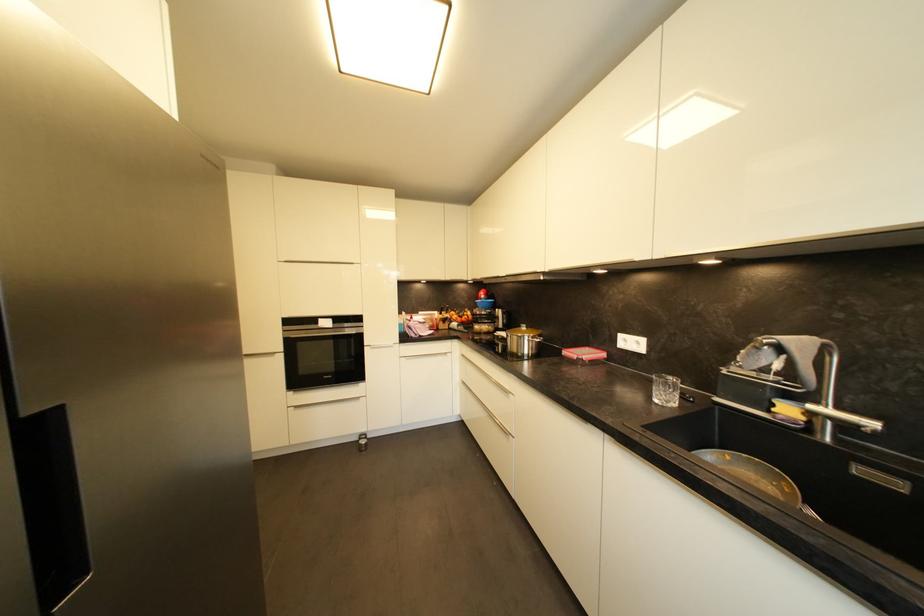
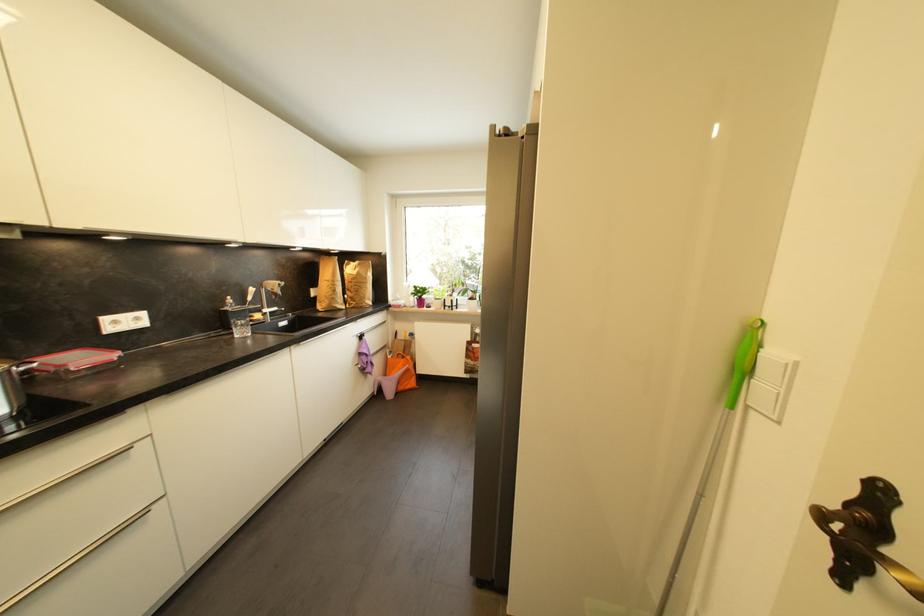
In the second image, find the point that corresponds to (642,345) in the first image.

(142, 321)